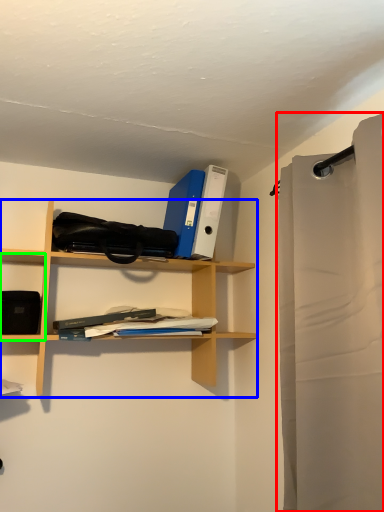
Question: Which object is the closest to the shower curtain (highlighted by a red box)? Choose among these: shelf (highlighted by a blue box) or cabinet (highlighted by a green box).

Choices:
 (A) shelf
 (B) cabinet

Answer: (A)